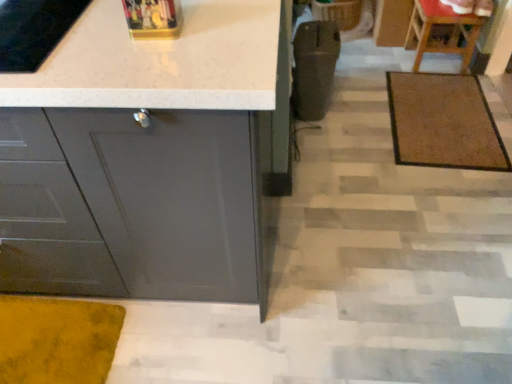
Question: Considering the relative positions of wooden chair at upper right and brown textured mat at center right in the image provided, is wooden chair at upper right behind brown textured mat at center right?

Choices:
 (A) no
 (B) yes

Answer: (B)

Question: Is wooden chair at upper right wider than brown textured mat at center right?

Choices:
 (A) no
 (B) yes

Answer: (A)

Question: From the image's perspective, is wooden chair at upper right above brown textured mat at center right?

Choices:
 (A) yes
 (B) no

Answer: (A)

Question: Considering the relative sizes of wooden chair at upper right and brown textured mat at center right in the image provided, is wooden chair at upper right shorter than brown textured mat at center right?

Choices:
 (A) yes
 (B) no

Answer: (B)

Question: Is wooden chair at upper right not close to brown textured mat at center right?

Choices:
 (A) yes
 (B) no

Answer: (B)

Question: Based on their positions, is matte gray cabinet at lower left located to the left or right of wooden chair at upper right?

Choices:
 (A) right
 (B) left

Answer: (B)

Question: From a real-world perspective, is matte gray cabinet at lower left physically located above or below wooden chair at upper right?

Choices:
 (A) below
 (B) above

Answer: (B)

Question: Choose the correct answer: Is matte gray cabinet at lower left inside wooden chair at upper right or outside it?

Choices:
 (A) inside
 (B) outside

Answer: (B)

Question: From the image's perspective, is matte gray cabinet at lower left positioned above or below wooden chair at upper right?

Choices:
 (A) above
 (B) below

Answer: (B)

Question: From the image's perspective, relative to matte gray cabinet at lower left, is brown textured mat at center right above or below?

Choices:
 (A) below
 (B) above

Answer: (B)

Question: From a real-world perspective, is brown textured mat at center right physically located above or below matte gray cabinet at lower left?

Choices:
 (A) below
 (B) above

Answer: (A)

Question: Visually, is brown textured mat at center right positioned to the left or to the right of matte gray cabinet at lower left?

Choices:
 (A) left
 (B) right

Answer: (B)

Question: From their relative heights in the image, would you say brown textured mat at center right is taller or shorter than matte gray cabinet at lower left?

Choices:
 (A) short
 (B) tall

Answer: (A)

Question: From the image's perspective, is wooden chair at upper right above or below brown textured mat at center right?

Choices:
 (A) below
 (B) above

Answer: (B)

Question: Is point (474, 44) positioned closer to the camera than point (487, 168)?

Choices:
 (A) farther
 (B) closer

Answer: (A)